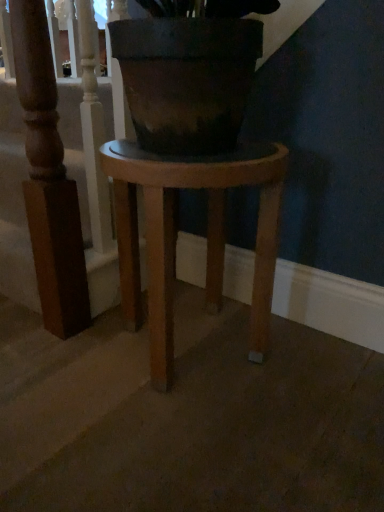
Question: Considering the relative positions of wooden baluster at upper left and wooden stool at center in the image provided, is wooden baluster at upper left to the right of wooden stool at center from the viewer's perspective?

Choices:
 (A) yes
 (B) no

Answer: (B)

Question: Can you confirm if wooden baluster at upper left is wider than wooden stool at center?

Choices:
 (A) no
 (B) yes

Answer: (A)

Question: Are wooden baluster at upper left and wooden stool at center making contact?

Choices:
 (A) yes
 (B) no

Answer: (B)

Question: Considering the relative positions of wooden baluster at upper left and wooden stool at center in the image provided, is wooden baluster at upper left to the left of wooden stool at center from the viewer's perspective?

Choices:
 (A) no
 (B) yes

Answer: (B)

Question: Does wooden baluster at upper left have a greater height compared to wooden stool at center?

Choices:
 (A) no
 (B) yes

Answer: (B)

Question: From the image's perspective, is wooden baluster at upper left under wooden stool at center?

Choices:
 (A) no
 (B) yes

Answer: (A)

Question: Is wooden baluster at upper left surrounded by wooden stool at center?

Choices:
 (A) no
 (B) yes

Answer: (A)

Question: From a real-world perspective, is wooden stool at center over wooden baluster at upper left?

Choices:
 (A) yes
 (B) no

Answer: (B)

Question: From the image's perspective, is wooden stool at center under wooden baluster at upper left?

Choices:
 (A) yes
 (B) no

Answer: (A)

Question: Is the depth of wooden stool at center greater than that of wooden baluster at upper left?

Choices:
 (A) no
 (B) yes

Answer: (A)

Question: Considering the relative sizes of wooden stool at center and wooden baluster at upper left in the image provided, is wooden stool at center wider than wooden baluster at upper left?

Choices:
 (A) no
 (B) yes

Answer: (B)

Question: Considering the relative sizes of wooden stool at center and wooden baluster at upper left in the image provided, is wooden stool at center thinner than wooden baluster at upper left?

Choices:
 (A) yes
 (B) no

Answer: (B)

Question: Considering the positions of wooden baluster at upper left and wooden stool at center in the image, is wooden baluster at upper left wider or thinner than wooden stool at center?

Choices:
 (A) wide
 (B) thin

Answer: (B)